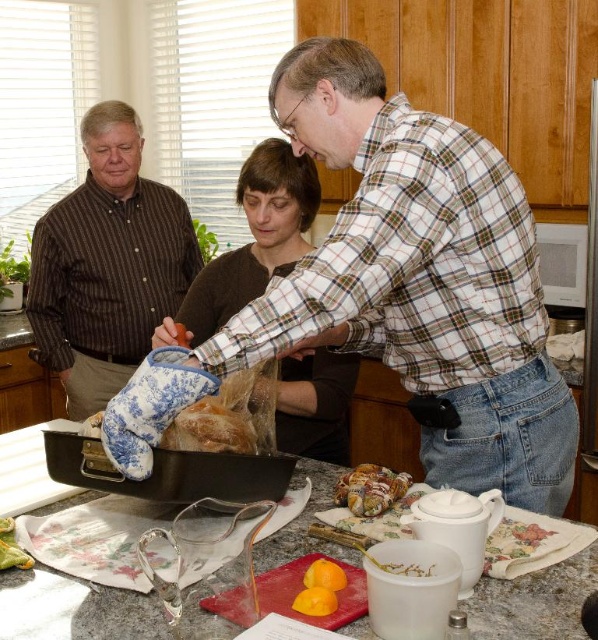
Can you confirm if brown striped shirt at left is shorter than yellow matte orange at center?

No.

The image size is (598, 640). Describe the element at coordinates (108, 264) in the screenshot. I see `brown striped shirt at left` at that location.

What do you see at coordinates (108, 264) in the screenshot? The height and width of the screenshot is (640, 598). I see `brown striped shirt at left` at bounding box center [108, 264].

Locate an element on the screen. The image size is (598, 640). brown striped shirt at left is located at coordinates (108, 264).

Locate an element on the screen. plaid shirt at center is located at coordinates (419, 280).

Does plaid shirt at center have a larger size compared to granite countertop at center?

Yes, plaid shirt at center is bigger than granite countertop at center.

Between point (413, 304) and point (306, 506), which one is positioned in front?

Positioned in front is point (413, 304).

Image resolution: width=598 pixels, height=640 pixels. In order to click on plaid shirt at center in this screenshot , I will do `click(419, 280)`.

Does blue floral oven mitt at center have a smaller size compared to yellow matte orange at center?

No.

Which is in front, point (236, 436) or point (341, 586)?

Point (341, 586)

Which is in front, point (224, 438) or point (316, 560)?

Point (316, 560)

Where is `blue floral oven mitt at center`? The height and width of the screenshot is (640, 598). blue floral oven mitt at center is located at coordinates (210, 428).